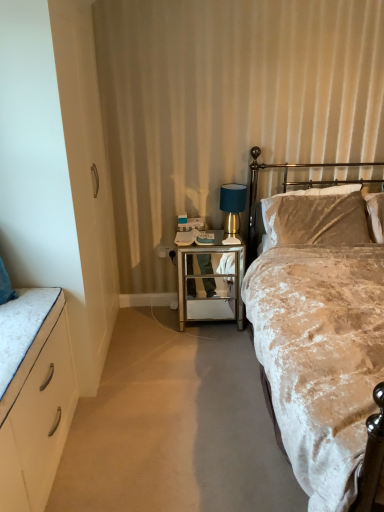
What do you see at coordinates (292, 184) in the screenshot?
I see `gold metallic headboard at upper right` at bounding box center [292, 184].

What are the coordinates of `gold metallic headboard at upper right` in the screenshot? It's located at tap(292, 184).

Find the location of a particular element. The image size is (384, 512). mirrored glass side table at center is located at coordinates (210, 279).

The height and width of the screenshot is (512, 384). What do you see at coordinates (210, 279) in the screenshot?
I see `mirrored glass side table at center` at bounding box center [210, 279].

Identify the location of black plastic power outlet at center. This screenshot has height=512, width=384. (166, 251).

Between gold metallic headboard at upper right and velvet beige bed at right, which one has more height?

velvet beige bed at right.

Which object is closer to the camera, gold metallic headboard at upper right or velvet beige bed at right?

velvet beige bed at right is closer to the camera.

From the image's perspective, which is above, gold metallic headboard at upper right or velvet beige bed at right?

gold metallic headboard at upper right appears higher in the image.

What's the angular difference between velvet beige bed at right and mirrored glass side table at center's facing directions?

The facing directions of velvet beige bed at right and mirrored glass side table at center are 0.000495 degrees apart.

Image resolution: width=384 pixels, height=512 pixels. Find the location of `bed in front of the mirrored glass side table at center`. bed in front of the mirrored glass side table at center is located at coordinates pos(320,342).

In terms of width, does velvet beige bed at right look wider or thinner when compared to mirrored glass side table at center?

velvet beige bed at right is wider than mirrored glass side table at center.

Considering the sizes of objects velvet beige bed at right and mirrored glass side table at center in the image provided, who is taller, velvet beige bed at right or mirrored glass side table at center?

With more height is velvet beige bed at right.

Between white matte cabinet at left and velvet beige bed at right, which one has smaller width?

white matte cabinet at left.

Is white matte cabinet at left in front of velvet beige bed at right?

No, the depth of white matte cabinet at left is greater than that of velvet beige bed at right.

Could you tell me if white matte cabinet at left is facing velvet beige bed at right?

Yes, white matte cabinet at left faces towards velvet beige bed at right.

Relative to teal fabric lampshade at right, is black plastic power outlet at center in front or behind?

In the image, black plastic power outlet at center appears behind teal fabric lampshade at right.

Is teal fabric lampshade at right at the back of black plastic power outlet at center?

No.

From the image's perspective, who appears lower, black plastic power outlet at center or teal fabric lampshade at right?

black plastic power outlet at center.

Considering the points (328, 195) and (34, 398), which point is behind, point (328, 195) or point (34, 398)?

The point (328, 195) is farther from the camera.

Between velvet beige bed at right and white matte cabinet at left, which one appears on the right side from the viewer's perspective?

velvet beige bed at right.

Would you say velvet beige bed at right is inside or outside white matte cabinet at left?

velvet beige bed at right exists outside the volume of white matte cabinet at left.

From the image's perspective, which is above, velvet beige bed at right or white matte cabinet at left?

From the image's view, velvet beige bed at right is above.

Considering the points (27, 412) and (338, 183), which point is in front, point (27, 412) or point (338, 183)?

The point (27, 412) is closer.

Which of these two, white matte cabinet at left or gold metallic headboard at upper right, is wider?

With larger width is white matte cabinet at left.

Which object is further away from the camera taking this photo, white matte cabinet at left or gold metallic headboard at upper right?

gold metallic headboard at upper right.

Is white matte cabinet at left inside or outside of gold metallic headboard at upper right?

white matte cabinet at left is not inside gold metallic headboard at upper right, it's outside.

Are black plastic power outlet at center and velvet beige bed at right making contact?

No, black plastic power outlet at center is not beside velvet beige bed at right.

Is black plastic power outlet at center behind velvet beige bed at right?

Yes.

Can you confirm if black plastic power outlet at center is smaller than velvet beige bed at right?

Yes, black plastic power outlet at center is smaller than velvet beige bed at right.

Is black plastic power outlet at center at the right side of velvet beige bed at right?

No, black plastic power outlet at center is not to the right of velvet beige bed at right.

The height and width of the screenshot is (512, 384). I want to click on headboard behind the velvet beige bed at right, so click(292, 184).

Identify the location of bed located above the mirrored glass side table at center (from a real-world perspective). The width and height of the screenshot is (384, 512). (320, 342).

Which object lies further to the anchor point velvet beige bed at right, gold metallic headboard at upper right or teal fabric lampshade at right?

Among the two, gold metallic headboard at upper right is located further to velvet beige bed at right.

From the image, which object appears to be nearer to velvet beige bed at right, teal fabric lampshade at right or white matte cabinet at left?

teal fabric lampshade at right is closer to velvet beige bed at right.

When comparing their distances from black plastic power outlet at center, does gold metallic headboard at upper right or white matte cabinet at left seem closer?

Based on the image, gold metallic headboard at upper right appears to be nearer to black plastic power outlet at center.

Consider the image. Estimate the real-world distances between objects in this image. Which object is closer to velvet beige bed at right, mirrored glass side table at center or black plastic power outlet at center?

mirrored glass side table at center lies closer to velvet beige bed at right than the other object.

Considering their positions, is gold metallic headboard at upper right positioned further to teal fabric lampshade at right than velvet beige bed at right?

Among the two, velvet beige bed at right is located further to teal fabric lampshade at right.

From the image, which object appears to be farther from gold metallic headboard at upper right, white matte cabinet at left or black plastic power outlet at center?

white matte cabinet at left is further to gold metallic headboard at upper right.

Which object lies further to the anchor point mirrored glass side table at center, teal fabric lampshade at right or velvet beige bed at right?

velvet beige bed at right is further to mirrored glass side table at center.

From the image, which object appears to be nearer to white matte cabinet at left, gold metallic headboard at upper right or mirrored glass side table at center?

Among the two, mirrored glass side table at center is located nearer to white matte cabinet at left.

Where is `headboard located between white matte cabinet at left and mirrored glass side table at center in the depth direction`? Image resolution: width=384 pixels, height=512 pixels. headboard located between white matte cabinet at left and mirrored glass side table at center in the depth direction is located at coordinates (292, 184).

Identify the location of power outlet that lies between teal fabric lampshade at right and mirrored glass side table at center from top to bottom. The image size is (384, 512). (166, 251).

I want to click on headboard located between velvet beige bed at right and mirrored glass side table at center in the depth direction, so click(292, 184).

Where is `desk between velvet beige bed at right and teal fabric lampshade at right in the front-back direction`? The image size is (384, 512). desk between velvet beige bed at right and teal fabric lampshade at right in the front-back direction is located at coordinates (210, 279).